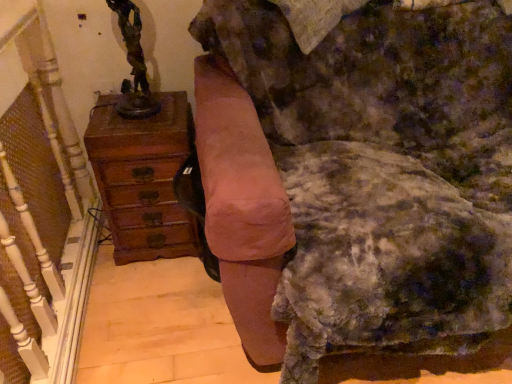
The image size is (512, 384). Identify the location of free space in front of wooden chest of drawers at left. (153, 293).